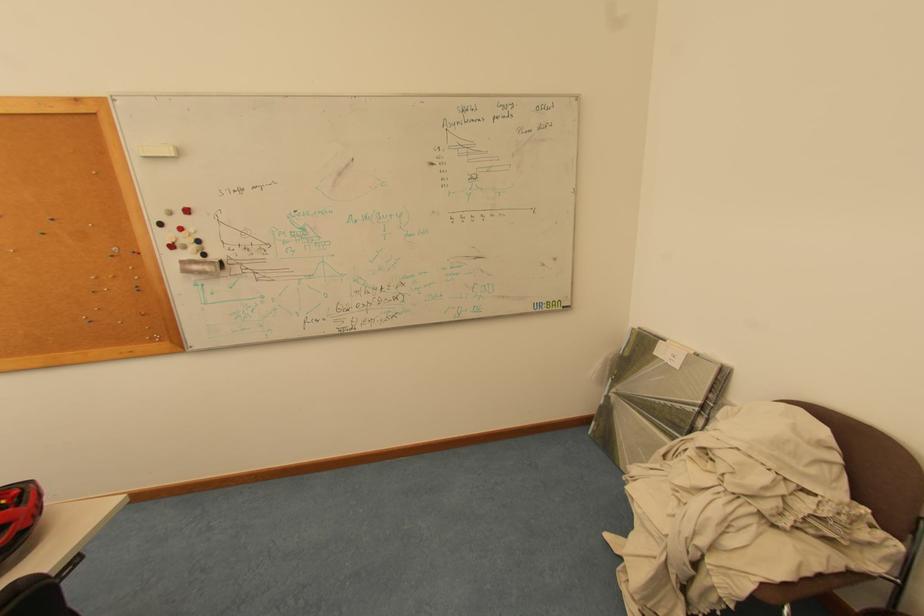
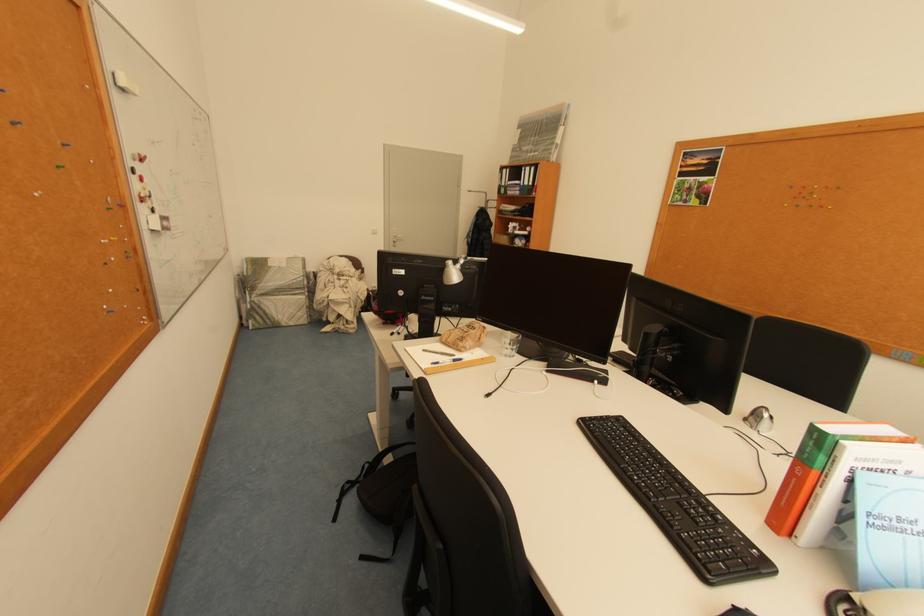
In the second image, find the point that corresponds to (x=168, y=225) in the first image.

(141, 172)